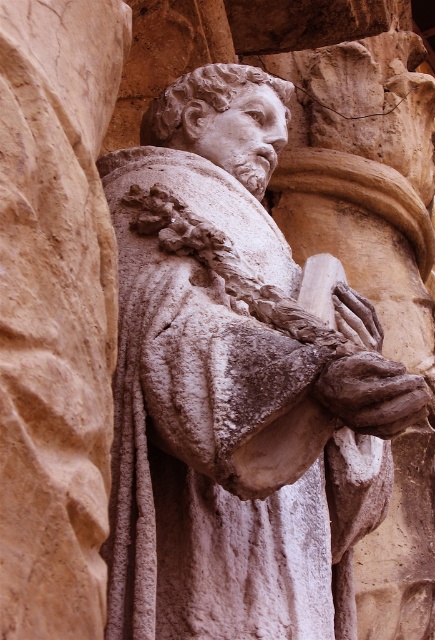
You are an art restorer examining the stone sculpture. You need to clean the white stone head at center and the brown stone hand at center. Which part should you start with if you want to work from the top down?

The white stone head at center is located above the brown stone hand at center, so you should start cleaning the white stone head at center first.